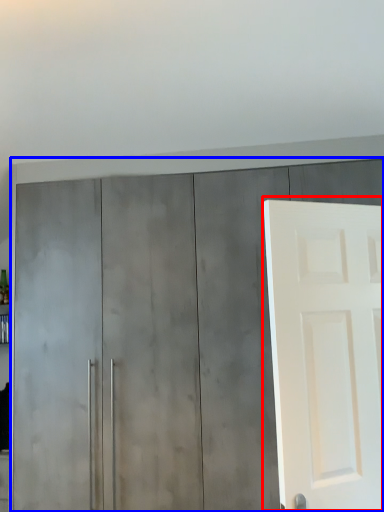
Question: Among these objects, which one is nearest to the camera, door (highlighted by a red box) or cupboard (highlighted by a blue box)?

Choices:
 (A) door
 (B) cupboard

Answer: (A)